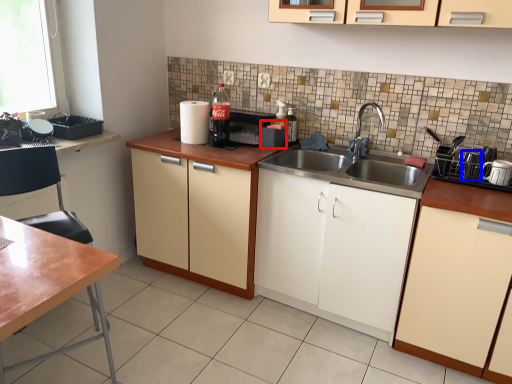
Question: Among these objects, which one is nearest to the camera, appliance (highlighted by a red box) or appliance (highlighted by a blue box)?

Choices:
 (A) appliance
 (B) appliance

Answer: (B)